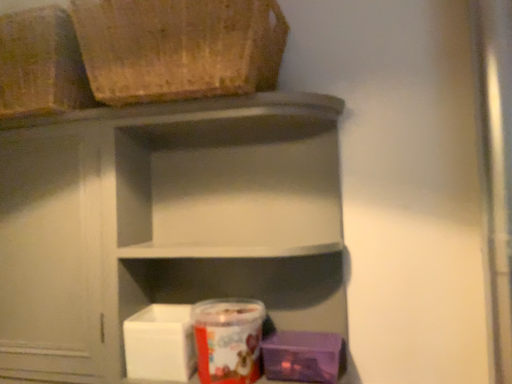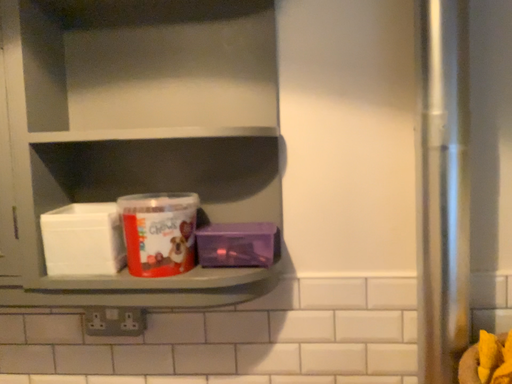
Question: How did the camera likely rotate when shooting the video?

Choices:
 (A) rotated left
 (B) rotated right

Answer: (B)